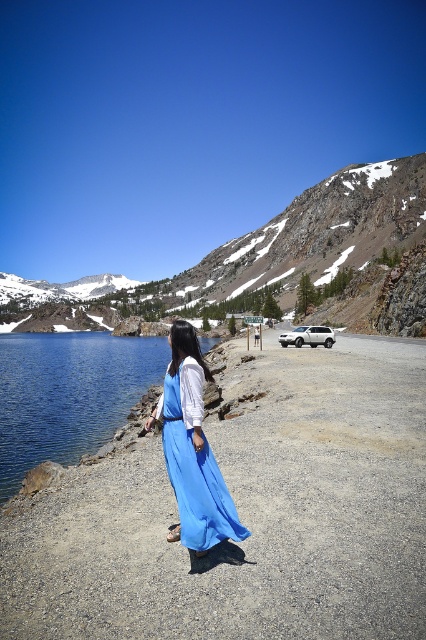
You are a photographer planning to capture a reflection shot of the blue satin dress at center in the blue glassy water at lower left. Based on the scene, is the dress positioned in a way that its reflection would be visible in the water?

The blue glassy water at lower left is located above the blue satin dress at center, so the dress is below the water level. Since reflections require the object to be above the water surface, the reflection would not be visible.